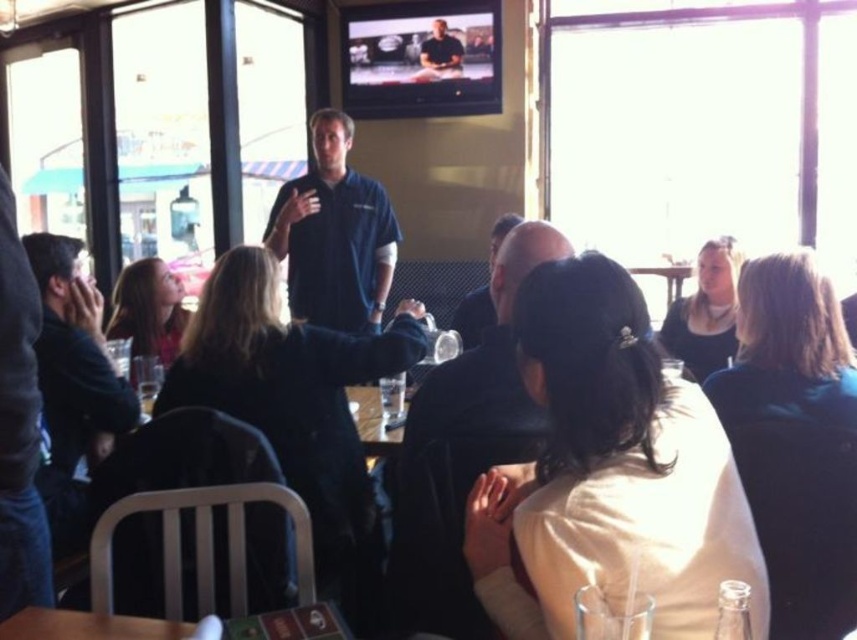
Question: Is dark blue polo shirt at center thinner than wooden table at center?

Choices:
 (A) yes
 (B) no

Answer: (B)

Question: Is dark blue shirt at left below wooden table at center?

Choices:
 (A) yes
 (B) no

Answer: (B)

Question: Does white matte shirt at center appear on the right side of dark blue shirt at left?

Choices:
 (A) yes
 (B) no

Answer: (A)

Question: Which point is closer to the camera?

Choices:
 (A) (346, 196)
 (B) (440, 19)
 (C) (399, 438)
 (D) (52, 234)

Answer: (C)

Question: Estimate the real-world distances between objects in this image. Which object is closer to the dark blue shirt at left?

Choices:
 (A) wooden table at center
 (B) black matte shirt at center
 (C) white matte shirt at center

Answer: (A)

Question: Which object is positioned farthest from the dark blue shirt at left?

Choices:
 (A) dark gray shirt at center
 (B) wooden table at center
 (C) dark blue shirt at center
 (D) dark blue polo shirt at center

Answer: (C)